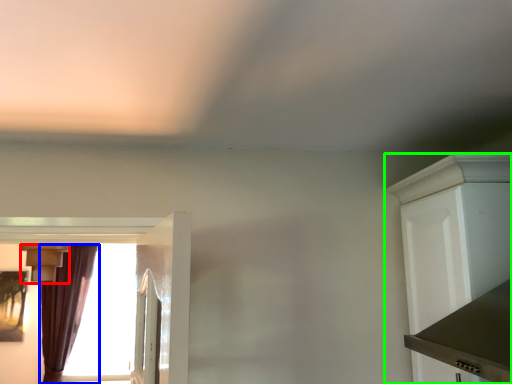
Question: Considering the real-world distances, which object is closest to light fixture (highlighted by a red box)? curtain (highlighted by a blue box) or cabinetry (highlighted by a green box).

Choices:
 (A) curtain
 (B) cabinetry

Answer: (A)